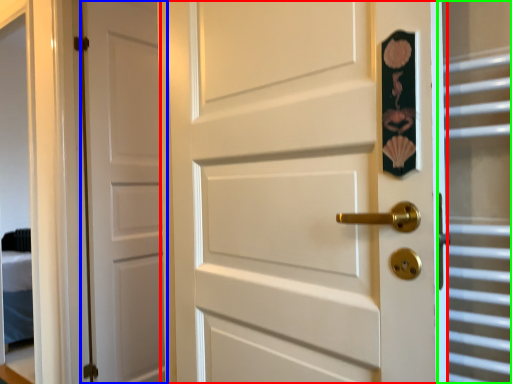
Question: Estimate the real-world distances between objects in this image. Which object is farther from door (highlighted by a red box), door (highlighted by a blue box) or glass door (highlighted by a green box)?

Choices:
 (A) door
 (B) glass door

Answer: (A)